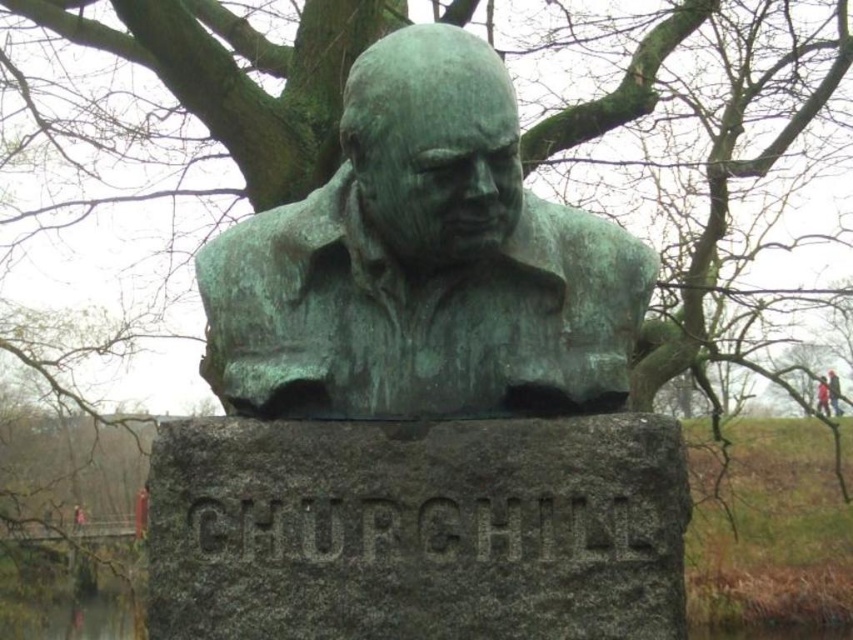
Question: Can you confirm if green patina bust at center is thinner than red fabric person at upper right?

Choices:
 (A) yes
 (B) no

Answer: (B)

Question: Among these objects, which one is nearest to the camera?

Choices:
 (A) green patina bust at center
 (B) red fabric person at upper right

Answer: (A)

Question: Observing the image, what is the correct spatial positioning of green patina bust at center in reference to red fabric person at upper right?

Choices:
 (A) right
 (B) left

Answer: (B)

Question: Does green patina bust at center come in front of red fabric person at upper right?

Choices:
 (A) no
 (B) yes

Answer: (B)

Question: Which point is farther from the camera taking this photo?

Choices:
 (A) (492, 381)
 (B) (821, 387)

Answer: (B)

Question: Which point is farther to the camera?

Choices:
 (A) (817, 401)
 (B) (367, 336)

Answer: (A)